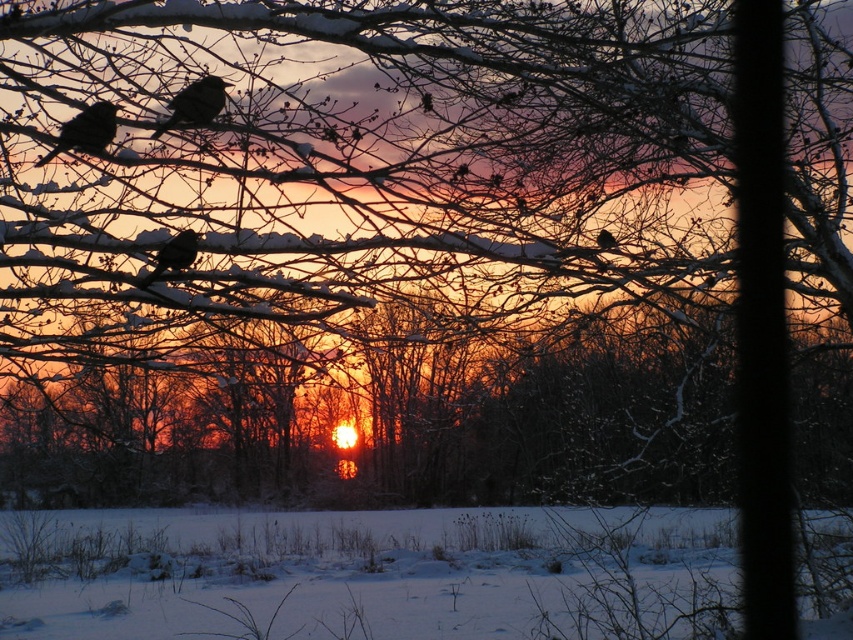
You are standing in the winter sunset scene and want to walk from the point at coordinates point (186, 257) to the point at coordinates point (604, 234). Since you can only walk on the snow, will you pass in front of or behind the tree branches in the foreground?

Since point (186, 257) is in front of point (604, 234), you will be walking from a position closer to the viewer towards a point further away. The tree branches in the foreground are already in front of the scene, so as you move towards the second point, you will pass behind the tree branches.

You are an ornithologist observing two birds perched on a snowdrift. The birds are both described as black matte bird at center and matte black bird at center. Which one is positioned lower on the snowdrift?

The black matte bird at center is positioned lower on the snowdrift than the matte black bird at center.